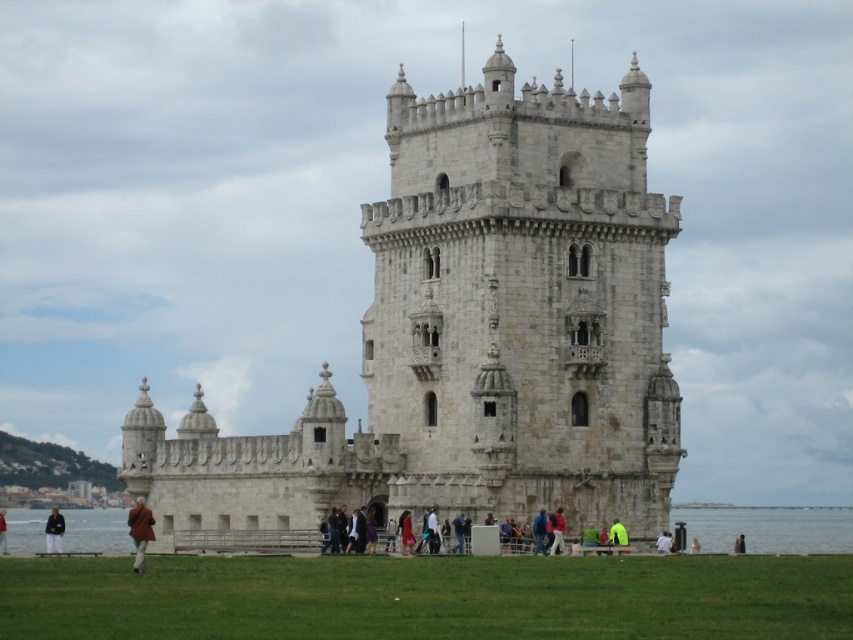
You are a tourist visiting Belem Tower and want to take a photo of the tower with both the brown wool coat at lower left and the red fabric jacket at center in the frame. Which object should you position closer to the camera to ensure both are visible in the photo?

To ensure both the brown wool coat at lower left and the red fabric jacket at center are visible in the photo, position the brown wool coat at lower left closer to the camera since it is already closer to the viewer than the red fabric jacket at center.

You are standing at the entrance of Belem Tower and want to place a small gift for a friend who is visiting the tower. You have a small box that needs to be placed near the brown wool coat at lower left. According to the coordinates provided, where exactly should you place the box?

The brown wool coat at lower left is located at coordinates point (140, 531), so you should place the box near that position.

You are a photographer planning to take a photo of the white stone castle at center and the red fabric jacket at center. Based on their sizes, which one should you focus on to ensure it stands out more in the photo?

The white stone castle at center is larger in size than the red fabric jacket at center, so focusing on the white stone castle at center will make it stand out more in the photo.